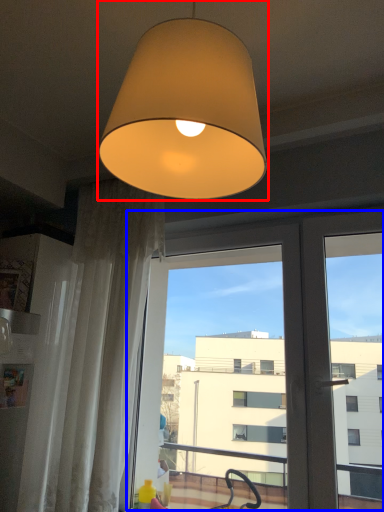
Question: Which object is further to the camera taking this photo, lamp (highlighted by a red box) or screen door (highlighted by a blue box)?

Choices:
 (A) lamp
 (B) screen door

Answer: (B)